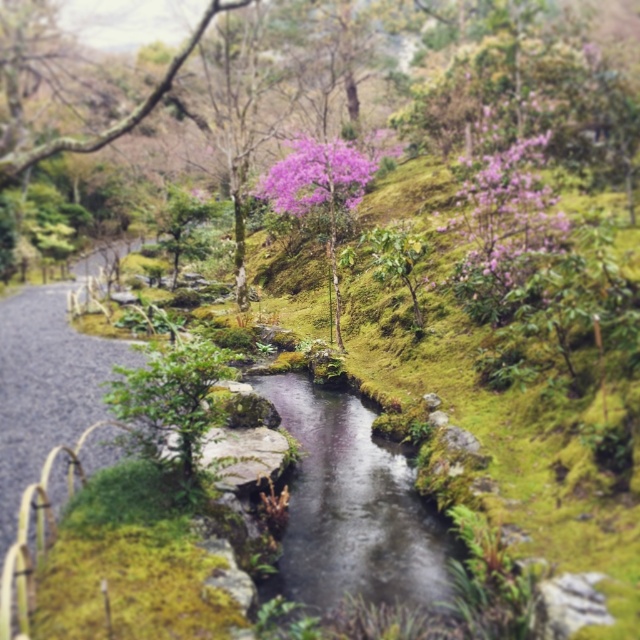
Measure the distance between purple matte flowers at upper right and purple matte flower at center.

purple matte flowers at upper right is 31.91 feet away from purple matte flower at center.

Describe the element at coordinates (504, 218) in the screenshot. I see `purple matte flowers at upper right` at that location.

Identify the location of purple matte flowers at upper right. coord(504,218).

Can you confirm if clear water stream at center is bigger than purple matte flowers at upper right?

Yes, clear water stream at center is bigger than purple matte flowers at upper right.

Is clear water stream at center below purple matte flowers at upper right?

Yes.

At what (x,y) coordinates should I click in order to perform the action: click on clear water stream at center. Please return your answer as a coordinate pair (x, y). The width and height of the screenshot is (640, 640). Looking at the image, I should click on (352, 508).

Looking at this image, does clear water stream at center have a smaller size compared to purple matte flower at center?

Yes.

Is clear water stream at center positioned at the back of purple matte flower at center?

That is False.

Is point (346, 412) farther from camera compared to point (346, 202)?

No.

Where is `clear water stream at center`? The image size is (640, 640). clear water stream at center is located at coordinates (352, 508).